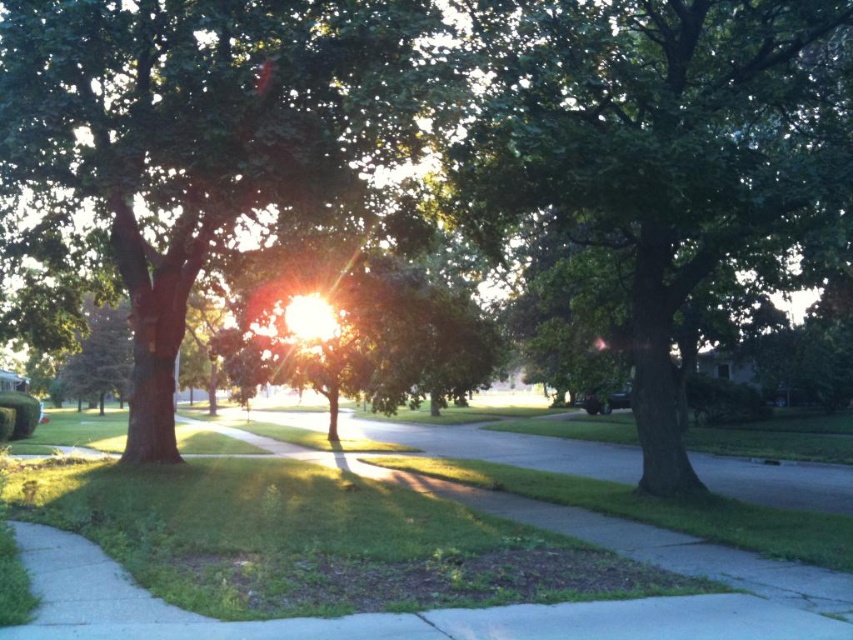
You are standing on the smooth concrete pavement at center and want to look up at the green matte tree at center. Considering their relative heights, will you need to tilt your head upwards to see the top of the tree?

The green matte tree at center is taller than the smooth concrete pavement at center, so yes, you will need to tilt your head upwards to see the top of the green matte tree at center.

You are standing at the origin point of the image. Which direction should you walk to reach the green matte tree at center?

Since the green matte tree at center is located at point coordinates of 0.208 on the x axis and 0.238 on the y axis, you should walk northeast to reach it from the origin point.